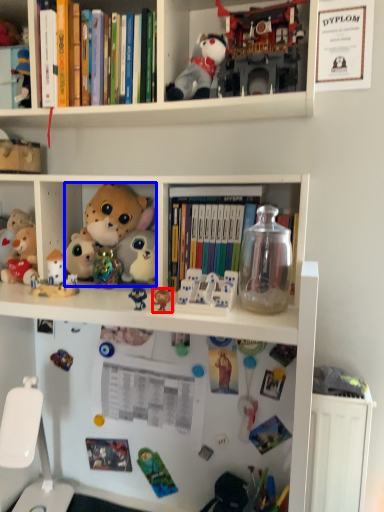
Question: Which object appears farthest to the camera in this image, toy (highlighted by a red box) or toy (highlighted by a blue box)?

Choices:
 (A) toy
 (B) toy

Answer: (B)